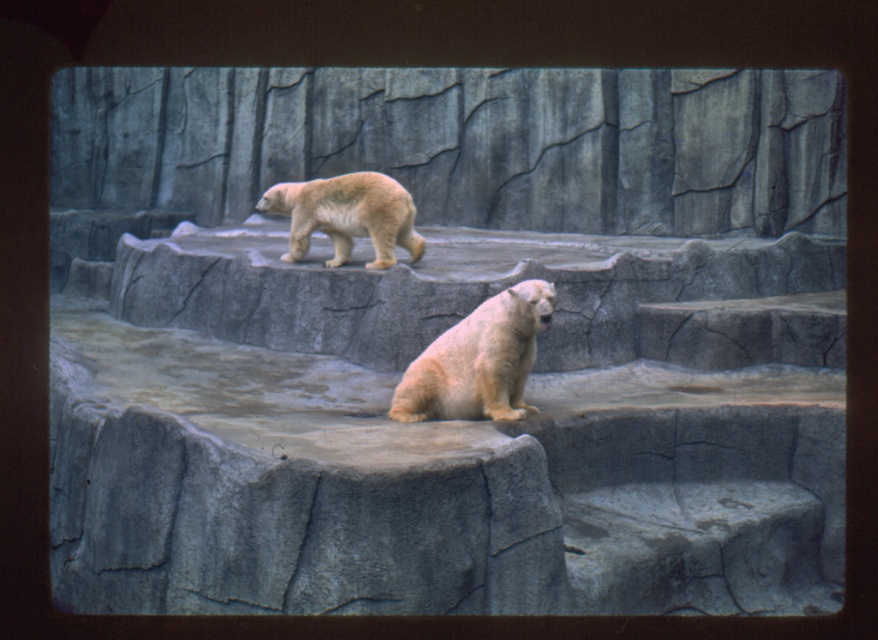
Does white fur bear at center appear on the right side of light beige fur at upper center?

Yes, white fur bear at center is to the right of light beige fur at upper center.

Describe the element at coordinates (479, 360) in the screenshot. I see `white fur bear at center` at that location.

You are a GUI agent. You are given a task and a screenshot of the screen. Output one action in this format:
    pyautogui.click(x=<x>, y=<y>)
    Task: Click on the white fur bear at center
    The image size is (878, 640).
    Given the screenshot: What is the action you would take?
    pyautogui.click(x=479, y=360)